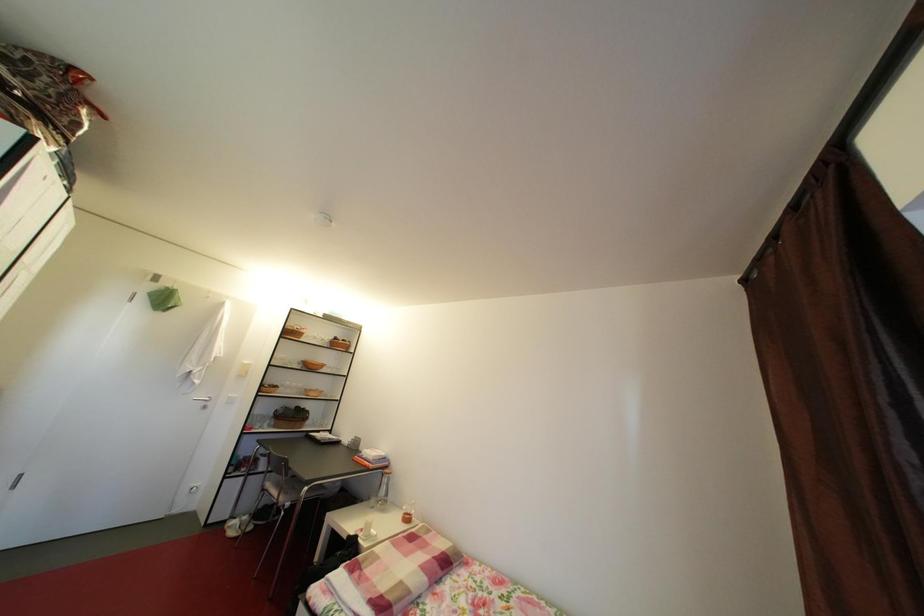
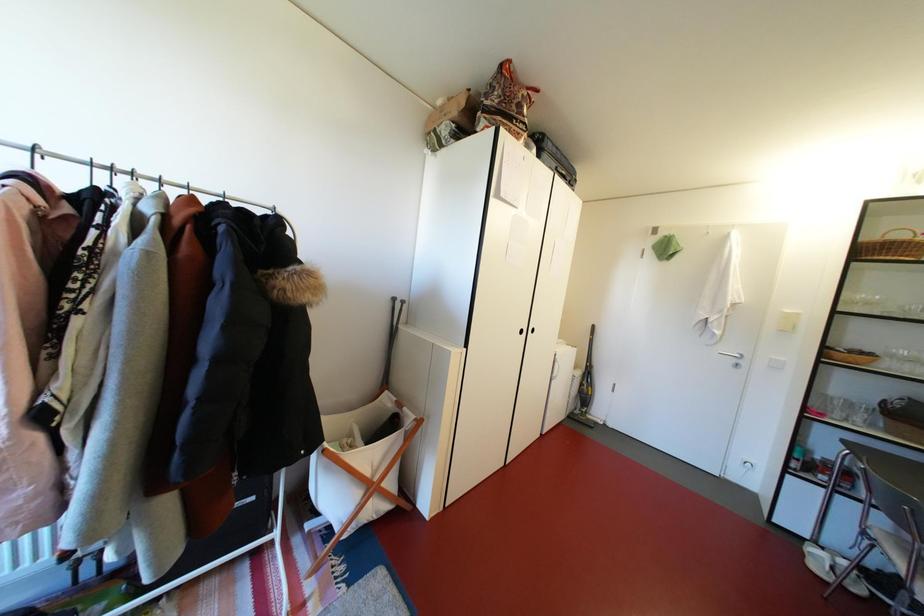
Question: The camera is either moving clockwise (left) or counter-clockwise (right) around the object. The first image is from the beginning of the video and the second image is from the end. Is the camera moving left or right when shooting the video?

Choices:
 (A) Left
 (B) Right

Answer: (B)